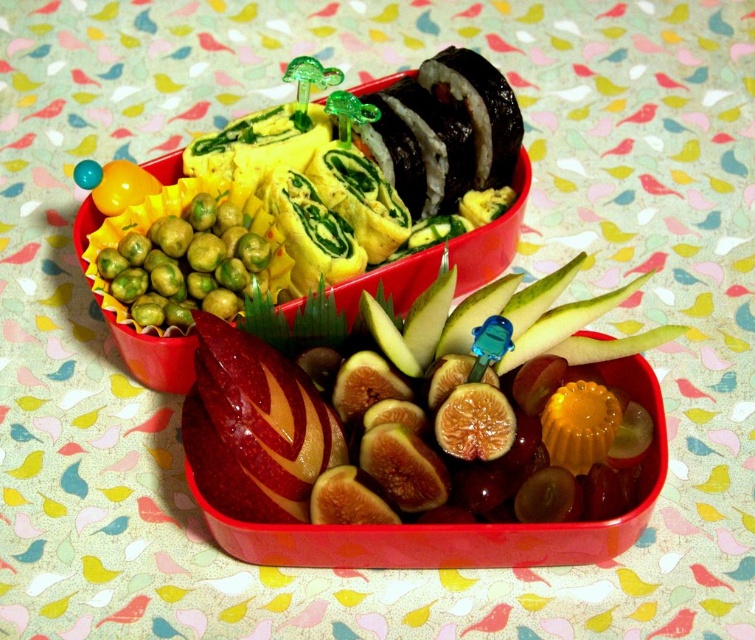
You are standing 5 feet away from the bento box. Is the point at coordinate (347, 356) on the bento box closer to you than your current position?

The distance of point (347, 356) from viewer is 4.18 feet, so yes, the point is closer to you than your current position which is 5 feet away.

You are a nutritionist analyzing the bento box. You need to determine which item takes up more space in the bento box. Which one is bigger in size between the shiny red apple at center and the green matte peas at upper left?

The shiny red apple at center has a larger size compared to the green matte peas at upper left, so it takes up more space in the bento box.

You are a nutritionist analyzing the bento box. You need to determine which food item is taller between the shiny red apple at center and the green matte peas at upper left. Which one is taller?

The shiny red apple at center is much taller than the green matte peas at upper left.